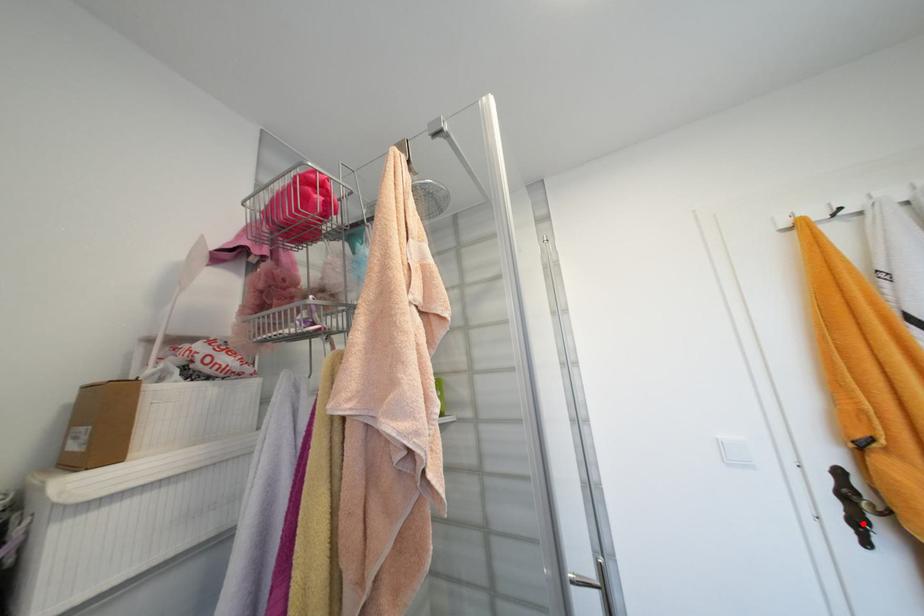
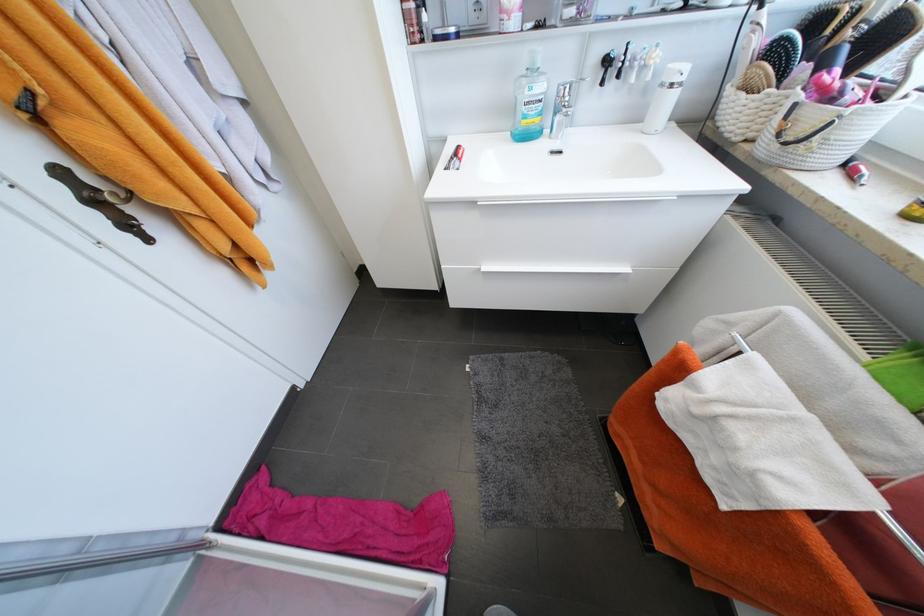
Where in the second image is the point corresponding to the highlighted location from the first image?

(132, 225)